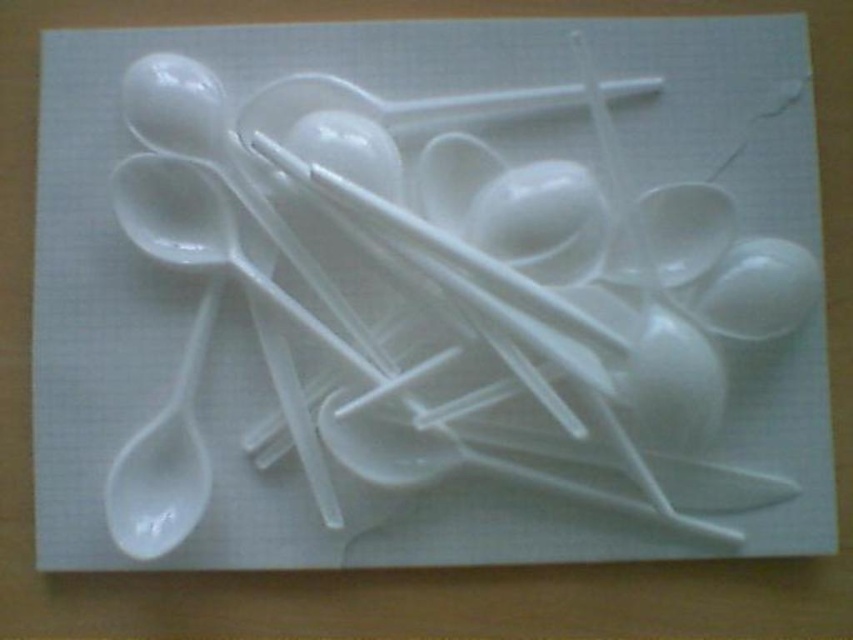
Based on the photo, you are arranging utensils on a table and need to place the white plastic spoon at center and the white glossy spoon at center in a specific order. According to the image, which spoon should be placed to the left of the other?

The white plastic spoon at center should be placed to the left of the white glossy spoon at center because the white plastic spoon at center is to the left of white glossy spoon at center in the image.

You are setting up a table for a party and need to choose between the white plastic spoon at center and the white glossy spoon at center. Which spoon is taller?

The white plastic spoon at center is taller than the white glossy spoon at center.